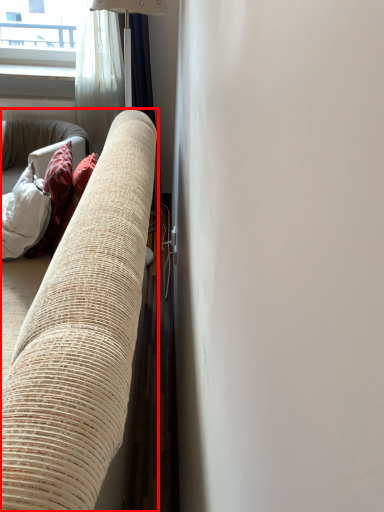
Question: Observing the image, what is the correct spatial positioning of studio couch (annotated by the red box) in reference to curtain?

Choices:
 (A) left
 (B) right

Answer: (A)